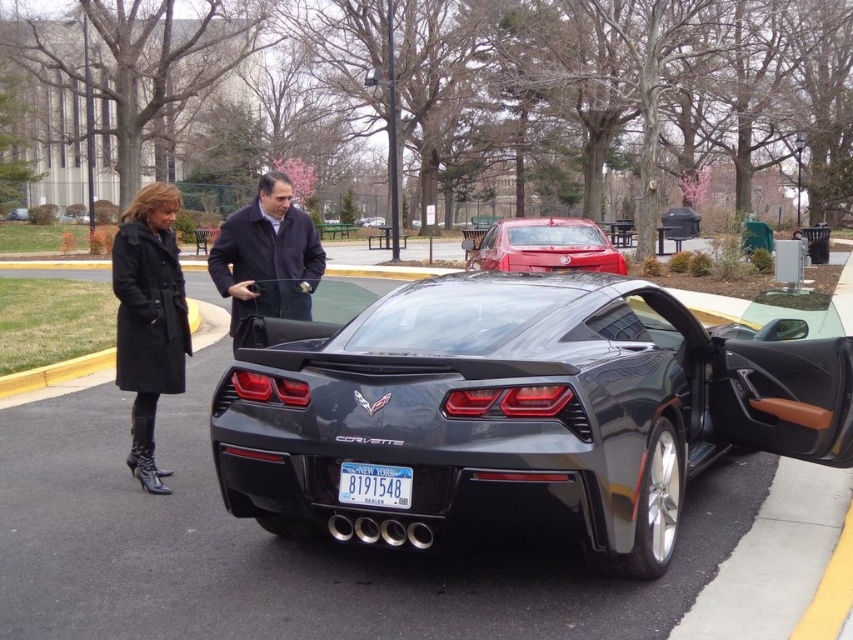
You are a valet parking attendant who needs to park the satin black sports car at center. However, there is a dark gray coat at center in the way. Based on the scene, can you drive the car forward without moving the coat?

The dark gray coat at center is in front of the satin black sports car at center, so driving forward would hit the coat. You need to move the coat first before driving forward.

Based on the photo, you are a delivery person who needs to load a package onto the shiny black car at center and the satin black sports car at center. The loading ramp you have can only reach vehicles within 200 feet. Can you use the same ramp to load both vehicles without moving it?

The shiny black car at center and the satin black sports car at center are 190.71 feet apart. Since the ramp can reach up to 200 feet, both vehicles are within the 200 feet range, so yes, you can load both vehicles using the same ramp without moving it.

You are a delivery person who needs to place a large package on the ground. The package is too heavy to hold, so you want to put it down temporarily. Given the scene described, where can you place the package without blocking the dark gray coat at center or the black rubber curb at lower left?

The package can be placed in an open area away from the dark gray coat at center and the black rubber curb at lower left. Since the dark gray coat at center is smaller than the black rubber curb at lower left, ensure the package does not obstruct either object by positioning it elsewhere on the paved area.